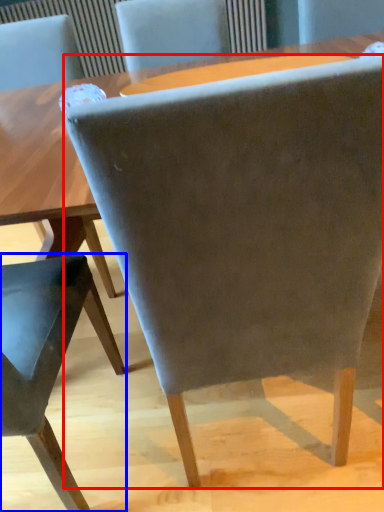
Question: Among these objects, which one is nearest to the camera, chair (highlighted by a red box) or chair (highlighted by a blue box)?

Choices:
 (A) chair
 (B) chair

Answer: (A)